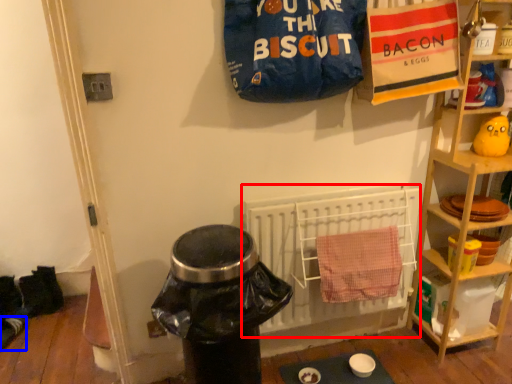
Question: Which point is closer to the camera, radiator (highlighted by a red box) or footwear (highlighted by a blue box)?

Choices:
 (A) radiator
 (B) footwear

Answer: (A)